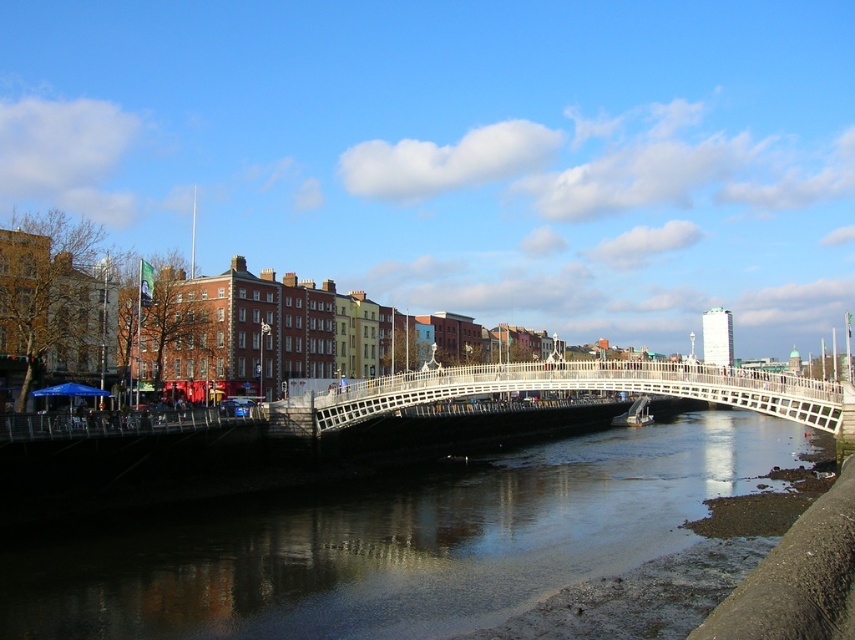
Is dark reflective water at center positioned in front of white wooden bridge at center?

Yes.

Is point (163, 556) farther from viewer compared to point (320, 406)?

No, (163, 556) is in front of (320, 406).

Where is `dark reflective water at center`? The width and height of the screenshot is (855, 640). dark reflective water at center is located at coordinates pos(394,541).